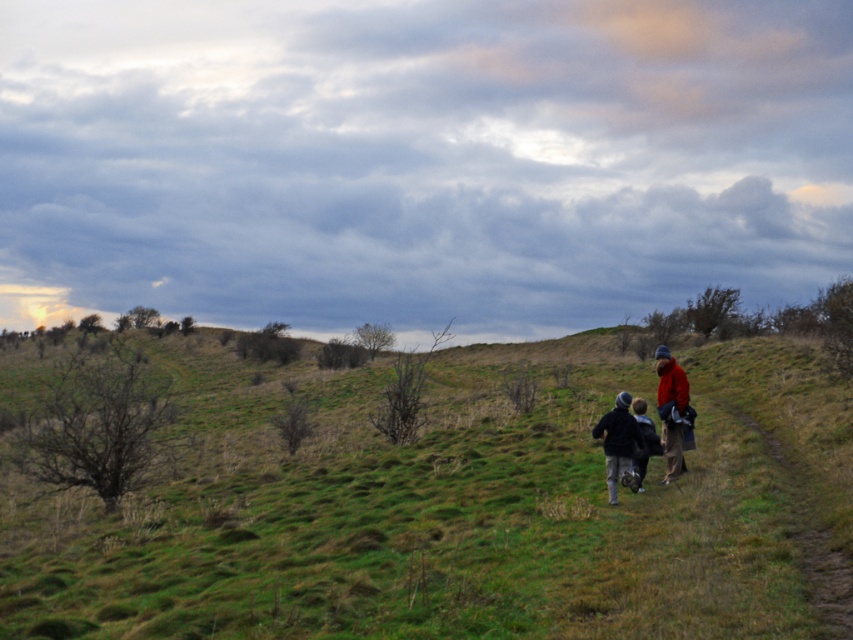
Question: Can you confirm if green grassy hillside at center is thinner than dark blue jacket at center?

Choices:
 (A) yes
 (B) no

Answer: (B)

Question: Based on their relative distances, which object is nearer to the dirt path at right?

Choices:
 (A) red woolen jacket at right
 (B) red woolen sweater at right
 (C) green grassy hillside at center
 (D) dark blue woolen sweater at center

Answer: (B)

Question: Is red woolen jacket at right closer to the viewer compared to dark blue woolen sweater at center?

Choices:
 (A) yes
 (B) no

Answer: (B)

Question: Is red woolen sweater at right thinner than dark blue jacket at center?

Choices:
 (A) no
 (B) yes

Answer: (A)

Question: Which object is the farthest from the red woolen sweater at right?

Choices:
 (A) dark blue woolen sweater at center
 (B) green grassy hillside at center
 (C) red woolen jacket at right
 (D) dark blue jacket at center

Answer: (B)

Question: Which of the following is the farthest from the observer?

Choices:
 (A) red woolen sweater at right
 (B) red woolen jacket at right
 (C) green grassy hillside at center
 (D) dirt path at right

Answer: (B)